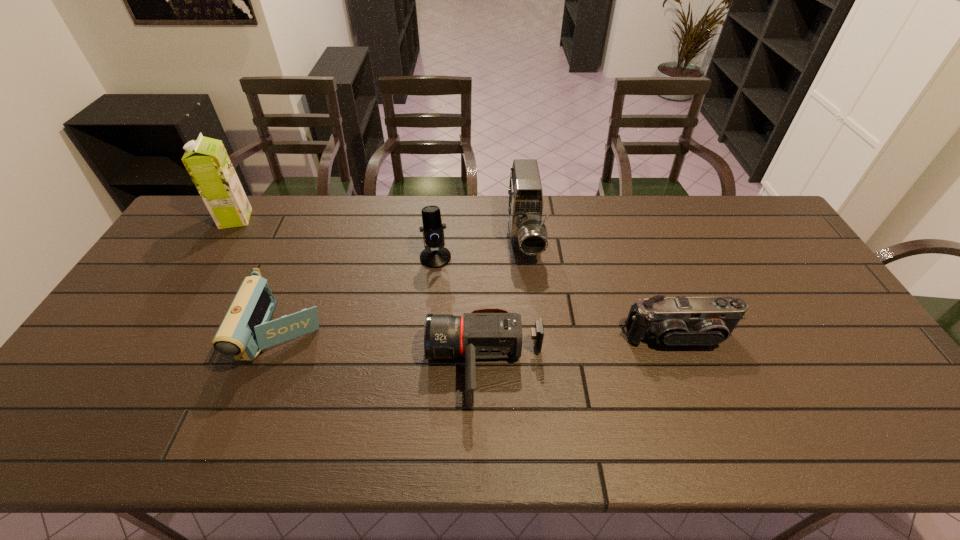
Find the location of a particular element. The width and height of the screenshot is (960, 540). free location located 0.110m on the stand of the fourth shortest object is located at coordinates (432, 295).

This screenshot has width=960, height=540. In order to click on vacant area located on the side of the leftmost camcorder with the flip-out screen in this screenshot , I will do `click(258, 402)`.

Locate an element on the screen. The width and height of the screenshot is (960, 540). vacant region located 0.230m on the front-facing side of the rightmost camcorder is located at coordinates (716, 440).

Where is `free space located on the lens of the shortest camcorder`? free space located on the lens of the shortest camcorder is located at coordinates (345, 365).

Where is `vacant space located 0.170m on the lens of the shortest camcorder`? vacant space located 0.170m on the lens of the shortest camcorder is located at coordinates (360, 365).

Where is `vacant space located 0.250m on the lens of the shortest camcorder`? The width and height of the screenshot is (960, 540). vacant space located 0.250m on the lens of the shortest camcorder is located at coordinates (328, 365).

This screenshot has width=960, height=540. I want to click on soya milk present at the far edge, so click(x=206, y=160).

The width and height of the screenshot is (960, 540). What are the coordinates of `camcorder at the far edge` in the screenshot? It's located at (528, 233).

Where is `object that is at the left edge`? The image size is (960, 540). object that is at the left edge is located at coordinates (206, 160).

The image size is (960, 540). Find the location of `object that is at the far left corner`. object that is at the far left corner is located at coordinates (206, 160).